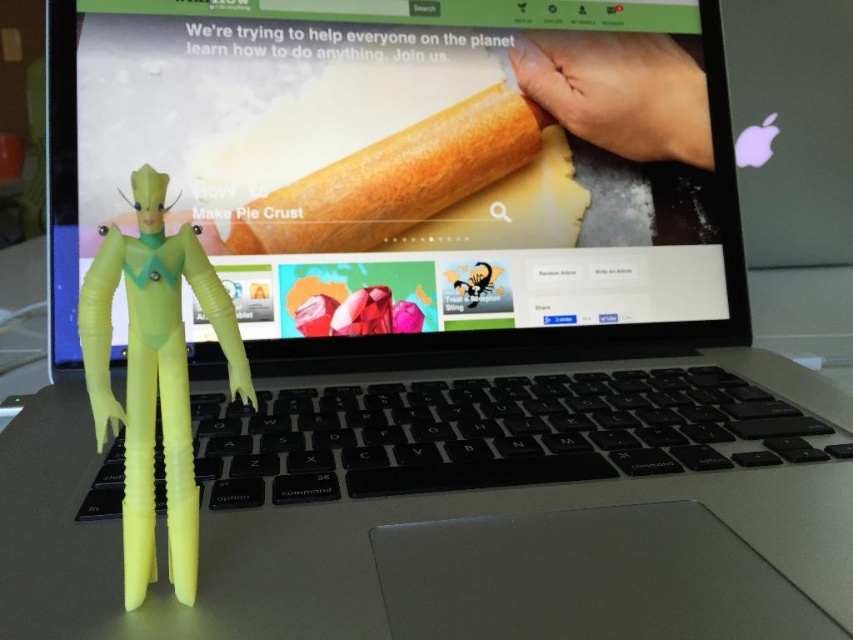
Is black plastic keyboard at center behind translucent yellow plastic figure at center?

Yes, it is behind translucent yellow plastic figure at center.

What do you see at coordinates (492, 433) in the screenshot? This screenshot has width=853, height=640. I see `black plastic keyboard at center` at bounding box center [492, 433].

Consider the image. Who is more distant from viewer, (572, 444) or (138, 381)?

Point (572, 444)

What are the coordinates of `black plastic keyboard at center` in the screenshot? It's located at (492, 433).

Looking at this image, who is taller, matte plastic laptop at center or smooth skin hand at upper right?

Standing taller between the two is matte plastic laptop at center.

Can you confirm if matte plastic laptop at center is bigger than smooth skin hand at upper right?

Yes.

This screenshot has width=853, height=640. What do you see at coordinates (401, 164) in the screenshot?
I see `matte plastic laptop at center` at bounding box center [401, 164].

Locate an element on the screen. Image resolution: width=853 pixels, height=640 pixels. matte plastic laptop at center is located at coordinates (401, 164).

Does translucent yellow plastic figure at center have a greater height compared to white matte pie crust at upper center?

Correct, translucent yellow plastic figure at center is much taller as white matte pie crust at upper center.

Is point (131, 376) less distant than point (299, 200)?

Yes, it is in front of point (299, 200).

What are the coordinates of `translucent yellow plastic figure at center` in the screenshot? It's located at (154, 376).